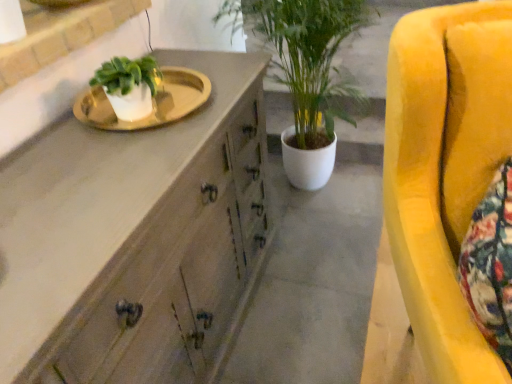
Find the location of a particular element. blank area to the left of white glossy sink at upper left is located at coordinates (62, 134).